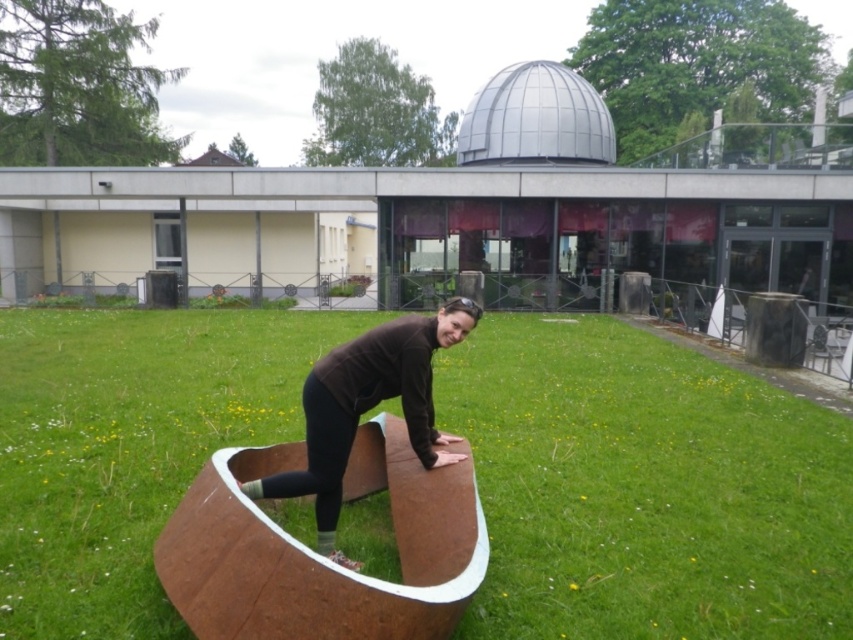
Question: Does green grass at center have a larger size compared to brown matte bench at center?

Choices:
 (A) no
 (B) yes

Answer: (B)

Question: Which point is farther from the camera taking this photo?

Choices:
 (A) (392, 353)
 (B) (112, 419)

Answer: (B)

Question: Which point is closer to the camera taking this photo?

Choices:
 (A) (519, 568)
 (B) (424, 419)

Answer: (B)

Question: In this image, where is green grass at center located relative to brown matte bench at center?

Choices:
 (A) below
 (B) above

Answer: (B)

Question: Observing the image, what is the correct spatial positioning of green grass at center in reference to brown matte bench at center?

Choices:
 (A) left
 (B) right

Answer: (A)